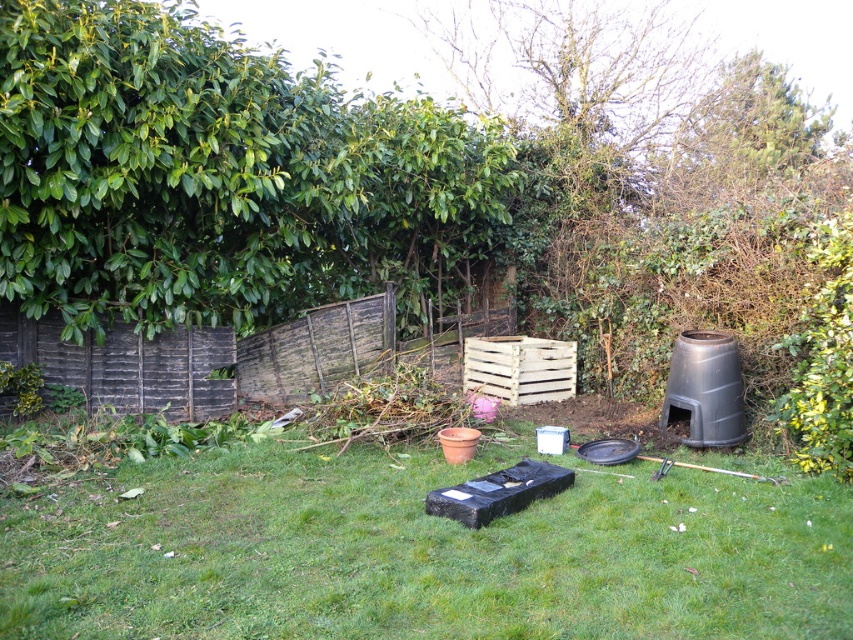
Question: Is weathered wood fence at center bigger than white wooden crate at center?

Choices:
 (A) yes
 (B) no

Answer: (A)

Question: Which point appears farthest from the camera in this image?

Choices:
 (A) (509, 401)
 (B) (111, 388)

Answer: (A)

Question: Which point is farther from the camera taking this photo?

Choices:
 (A) (229, 360)
 (B) (553, 340)

Answer: (B)

Question: Is green grass at center further to camera compared to weathered wood fence at center?

Choices:
 (A) yes
 (B) no

Answer: (B)

Question: Which object is farther from the camera taking this photo?

Choices:
 (A) white wooden crate at center
 (B) weathered wood fence at center

Answer: (A)

Question: Can you confirm if green grass at center is thinner than weathered wood fence at center?

Choices:
 (A) no
 (B) yes

Answer: (A)